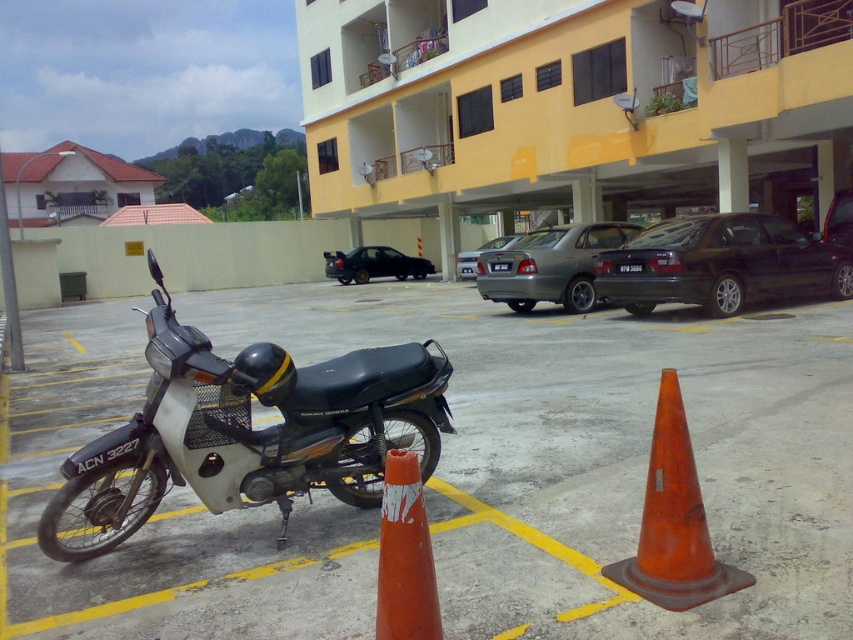
Is black metallic car at right below orange rubber traffic cone at lower center?

No.

Between black metallic car at right and orange rubber traffic cone at lower center, which one appears on the left side from the viewer's perspective?

Positioned to the left is orange rubber traffic cone at lower center.

The width and height of the screenshot is (853, 640). What are the coordinates of `black metallic car at right` in the screenshot? It's located at (720, 264).

Where is `black metallic car at right`? This screenshot has width=853, height=640. black metallic car at right is located at coordinates (720, 264).

Does point (701, 566) come farther from viewer compared to point (479, 253)?

No, (701, 566) is in front of (479, 253).

The width and height of the screenshot is (853, 640). Describe the element at coordinates (672, 522) in the screenshot. I see `orange rubber traffic cone at lower right` at that location.

Identify the location of orange rubber traffic cone at lower right. The height and width of the screenshot is (640, 853). (672, 522).

Between black metallic car at right and black matte sedan at center, which one appears on the left side from the viewer's perspective?

From the viewer's perspective, black matte sedan at center appears more on the left side.

Between black metallic car at right and black matte sedan at center, which one is positioned higher?

Positioned higher is black matte sedan at center.

Measure the distance between point (639, 275) and camera.

Point (639, 275) and camera are 40.87 feet apart from each other.

Where is `black metallic car at right`? black metallic car at right is located at coordinates (720, 264).